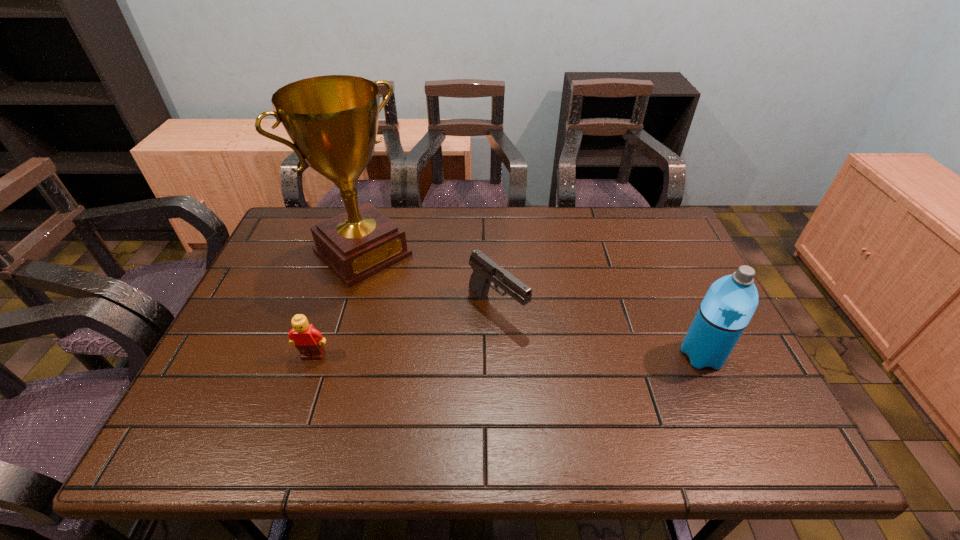
Find the location of a particular element. This screenshot has height=540, width=960. vacant space located 0.100m aim along the barrel of the pistol is located at coordinates (546, 352).

At what (x,y) coordinates should I click in order to perform the action: click on free space located 0.300m aim along the barrel of the pistol. Please return your answer as a coordinate pair (x, y). Looking at the image, I should click on (614, 408).

The width and height of the screenshot is (960, 540). I want to click on vacant space located 0.220m aim along the barrel of the pistol, so click(586, 383).

This screenshot has width=960, height=540. Find the location of `object at the far edge`. object at the far edge is located at coordinates (332, 120).

Find the location of a particular element. object that is at the left edge is located at coordinates (332, 120).

Identify the location of object that is at the right edge. The image size is (960, 540). (728, 306).

Locate an element on the screen. The height and width of the screenshot is (540, 960). object at the far left corner is located at coordinates (332, 120).

Where is `free space at the far edge`? free space at the far edge is located at coordinates (469, 224).

Identify the location of vacant region at the near edge of the desktop. coord(336,392).

Identify the location of vacant space at the left edge of the desktop. (216, 359).